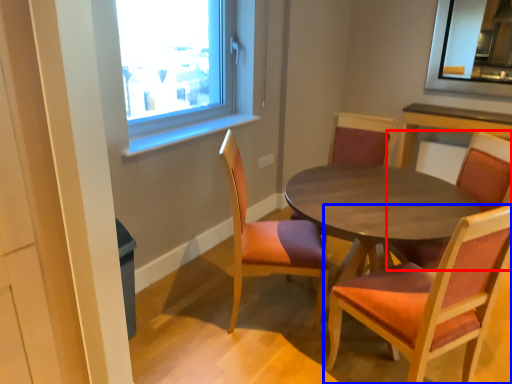
Question: Which point is closer to the camera, chair (highlighted by a red box) or chair (highlighted by a blue box)?

Choices:
 (A) chair
 (B) chair

Answer: (B)